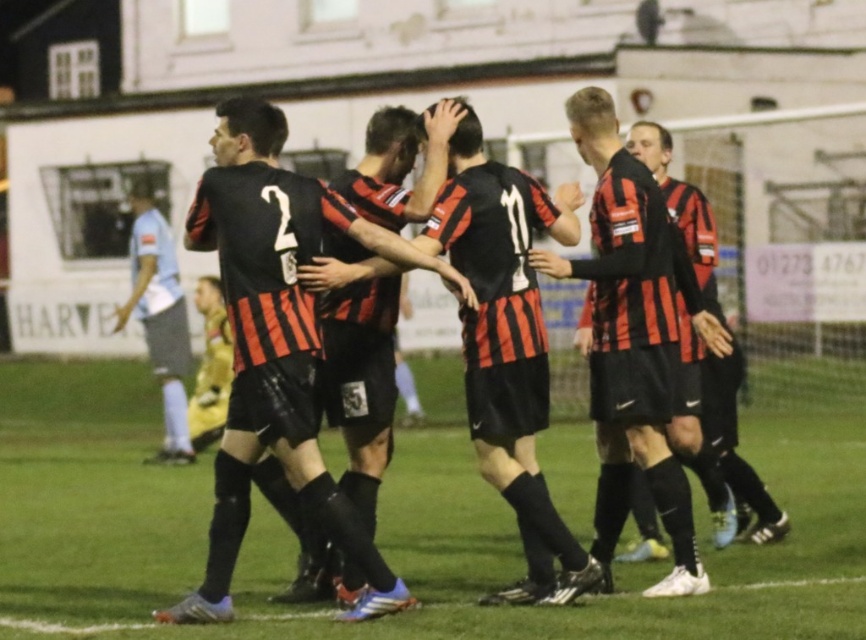
Based on the photo, you are a soccer ball placed at the edge of the green grass at center. You want to roll towards the matte black jersey at center. Given that the ball can roll 3 meters before stopping, will you reach the jersey?

The distance between the green grass at center and the matte black jersey at center is 2.93 meters. Since the ball can roll 3 meters, it will reach the matte black jersey at center.

You are a photographer at the soccer match and want to capture the entire green grass at center and the black matte jersey at center in a single frame. Which object should you focus on to ensure both are in the frame without cropping?

Since the green grass at center is larger in size than the black matte jersey at center, you should focus on the green grass at center to ensure both objects fit within the frame.

You are a photographer standing at the edge of the soccer field. You want to capture both the black matte jersey at center and the matte black jersey at center in a single photo. Which jersey should you zoom in on to ensure both are clearly visible in the frame?

The black matte jersey at center is larger in size than the matte black jersey at center, so zooming in on the larger one will allow the smaller one to still be visible in the frame.